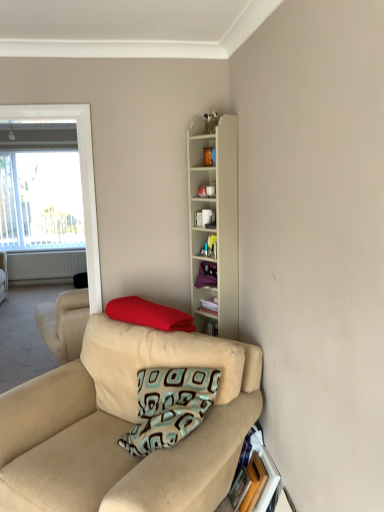
Question: Is white matte radiator at left far away from red fabric pillow at center?

Choices:
 (A) yes
 (B) no

Answer: (A)

Question: Considering the relative sizes of white matte radiator at left and red fabric pillow at center in the image provided, is white matte radiator at left shorter than red fabric pillow at center?

Choices:
 (A) yes
 (B) no

Answer: (B)

Question: Does white matte radiator at left contain red fabric pillow at center?

Choices:
 (A) yes
 (B) no

Answer: (B)

Question: Is white matte radiator at left next to red fabric pillow at center?

Choices:
 (A) no
 (B) yes

Answer: (A)

Question: Is white matte radiator at left looking in the opposite direction of red fabric pillow at center?

Choices:
 (A) no
 (B) yes

Answer: (A)

Question: Is red fabric pillow at center inside the boundaries of wooden picture frame at lower right, or outside?

Choices:
 (A) inside
 (B) outside

Answer: (B)

Question: From a real-world perspective, is red fabric pillow at center physically located above or below wooden picture frame at lower right?

Choices:
 (A) below
 (B) above

Answer: (B)

Question: Is point (150, 310) closer or farther from the camera than point (236, 476)?

Choices:
 (A) closer
 (B) farther

Answer: (B)

Question: In the image, is red fabric pillow at center positioned in front of or behind wooden picture frame at lower right?

Choices:
 (A) behind
 (B) front

Answer: (A)

Question: Is beige fabric couch at lower left in front of or behind beige wood cabinet at upper center in the image?

Choices:
 (A) behind
 (B) front

Answer: (B)

Question: From the image's perspective, is beige fabric couch at lower left located above or below beige wood cabinet at upper center?

Choices:
 (A) above
 (B) below

Answer: (B)

Question: Based on their positions, is beige fabric couch at lower left located to the left or right of beige wood cabinet at upper center?

Choices:
 (A) right
 (B) left

Answer: (B)

Question: Does point (147, 501) appear closer or farther from the camera than point (190, 276)?

Choices:
 (A) farther
 (B) closer

Answer: (B)

Question: From a real-world perspective, is red fabric pillow at center positioned above or below beige wood cabinet at upper center?

Choices:
 (A) above
 (B) below

Answer: (B)

Question: From their relative heights in the image, would you say red fabric pillow at center is taller or shorter than beige wood cabinet at upper center?

Choices:
 (A) tall
 (B) short

Answer: (B)